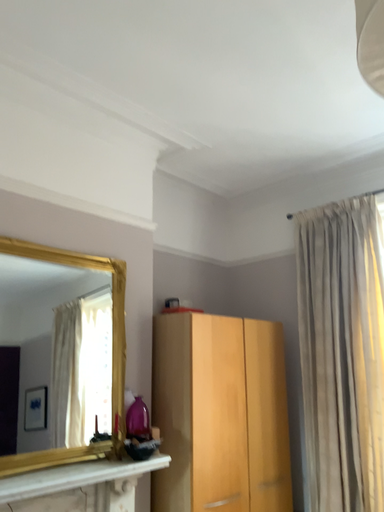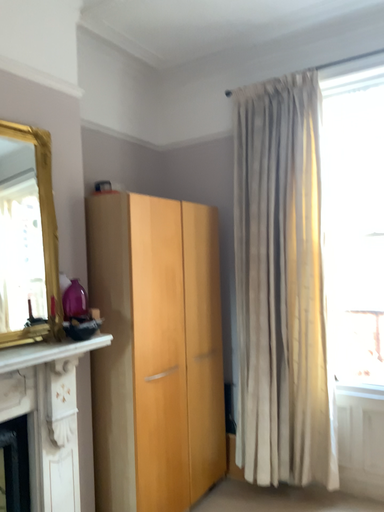
Question: Which way did the camera rotate in the video?

Choices:
 (A) rotated downward
 (B) rotated upward

Answer: (A)